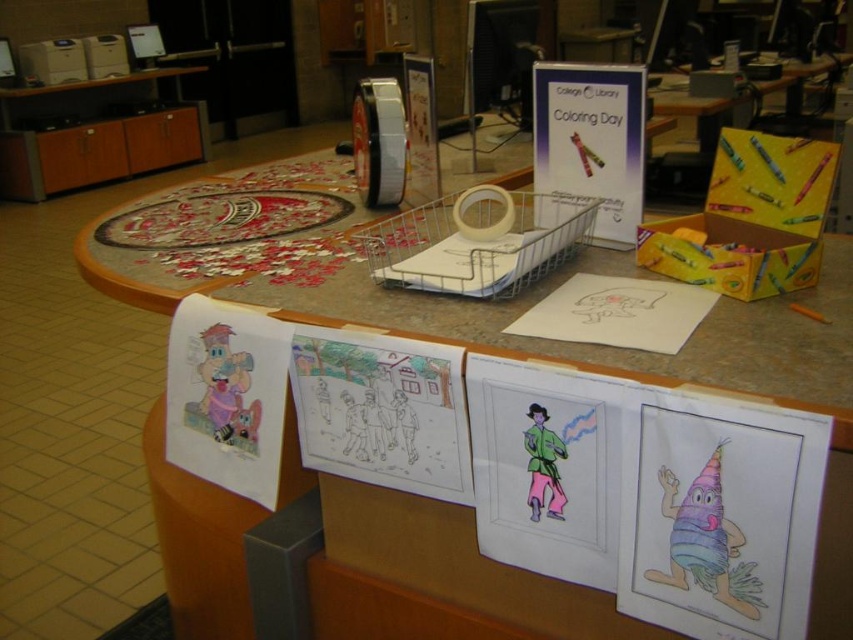
Question: Does smooth brown countertop at center appear on the left side of orange matte crayon at center?

Choices:
 (A) yes
 (B) no

Answer: (A)

Question: Which point is closer to the camera?

Choices:
 (A) smooth brown countertop at center
 (B) orange matte crayon at center

Answer: (A)

Question: Which point is closer to the camera?

Choices:
 (A) smooth brown countertop at center
 (B) orange matte crayon at center

Answer: (A)

Question: Observing the image, what is the correct spatial positioning of smooth brown countertop at center in reference to orange matte crayon at center?

Choices:
 (A) right
 (B) left

Answer: (B)

Question: Does smooth brown countertop at center have a larger size compared to orange matte crayon at center?

Choices:
 (A) no
 (B) yes

Answer: (B)